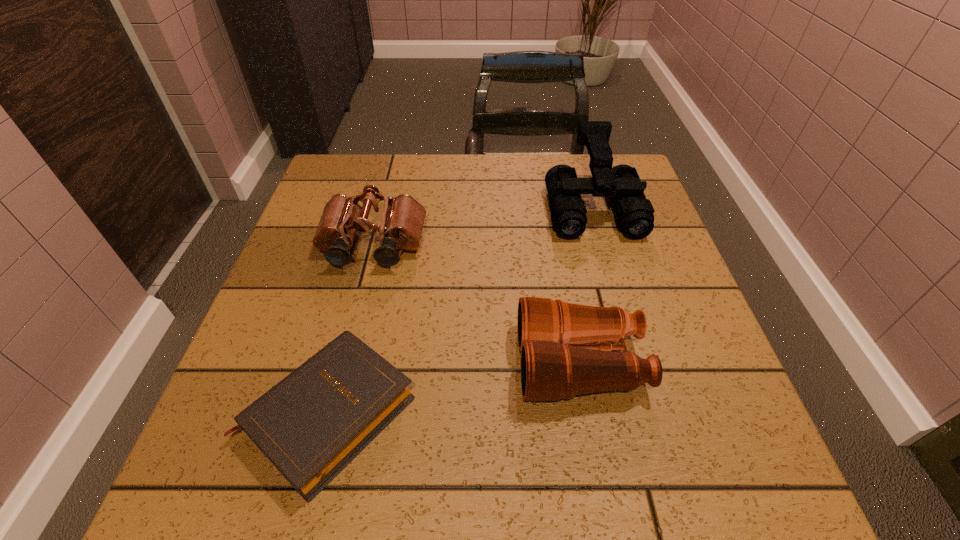
The height and width of the screenshot is (540, 960). In order to click on free space between the leftmost binoculars and the Bible in this screenshot , I will do `click(350, 329)`.

Select which object is the closest to the Bible. Please provide its 2D coordinates. Your answer should be formatted as a tuple, i.e. [(x, y)], where the tuple contains the x and y coordinates of a point satisfying the conditions above.

[(557, 361)]

Point out which object is positioned as the nearest to the Bible. Please provide its 2D coordinates. Your answer should be formatted as a tuple, i.e. [(x, y)], where the tuple contains the x and y coordinates of a point satisfying the conditions above.

[(557, 361)]

Locate which binoculars ranks in proximity to the tallest binoculars. Please provide its 2D coordinates. Your answer should be formatted as a tuple, i.e. [(x, y)], where the tuple contains the x and y coordinates of a point satisfying the conditions above.

[(557, 361)]

The height and width of the screenshot is (540, 960). In order to click on binoculars that is the nearest to the nearest binoculars in this screenshot , I will do `click(635, 214)`.

I want to click on free spot that satisfies the following two spatial constraints: 1. on the front lenses of the tallest binoculars; 2. through the lenses of the nearest binoculars, so click(x=637, y=363).

Identify the location of free space that satisfies the following two spatial constraints: 1. on the front lenses of the tallest object; 2. through the lenses of the nearest binoculars. (637, 363).

This screenshot has height=540, width=960. I want to click on free space that satisfies the following two spatial constraints: 1. through the lenses of the nearest binoculars; 2. on the front side of the shortest object, so click(x=589, y=413).